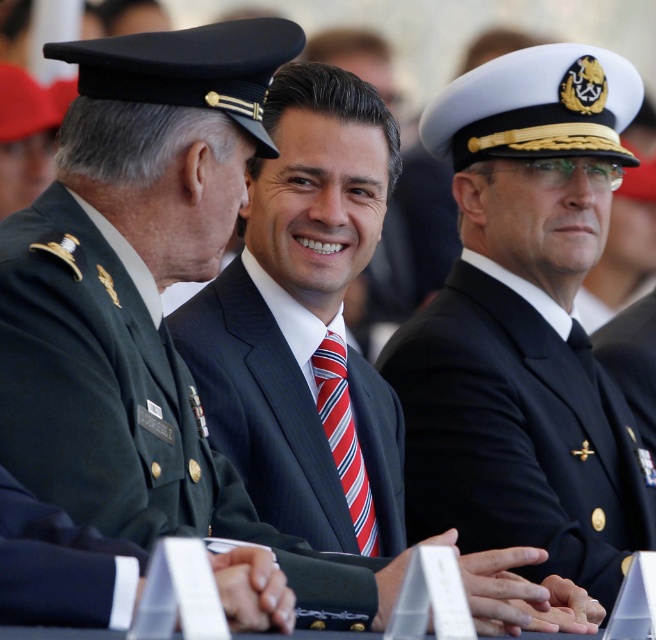
Question: Is navy blue fabric suit at center to the right of red striped tie at center from the viewer's perspective?

Choices:
 (A) no
 (B) yes

Answer: (B)

Question: Is navy blue fabric suit at center wider than red striped tie at center?

Choices:
 (A) no
 (B) yes

Answer: (A)

Question: Which point is closer to the camera?

Choices:
 (A) red striped tie at center
 (B) navy blue fabric suit at center

Answer: (B)

Question: Among these points, which one is nearest to the camera?

Choices:
 (A) (516, 340)
 (B) (325, 348)

Answer: (B)

Question: Where is navy blue fabric suit at center located in relation to red striped tie at center in the image?

Choices:
 (A) right
 (B) left

Answer: (A)

Question: Which of the following is the closest to the observer?

Choices:
 (A) (319, 410)
 (B) (533, 406)

Answer: (A)